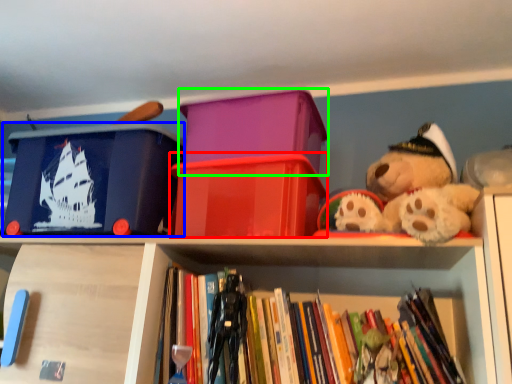
Question: Which object is the closest to the storage box (highlighted by a red box)? Choose among these: storage box (highlighted by a blue box) or storage box (highlighted by a green box).

Choices:
 (A) storage box
 (B) storage box

Answer: (B)